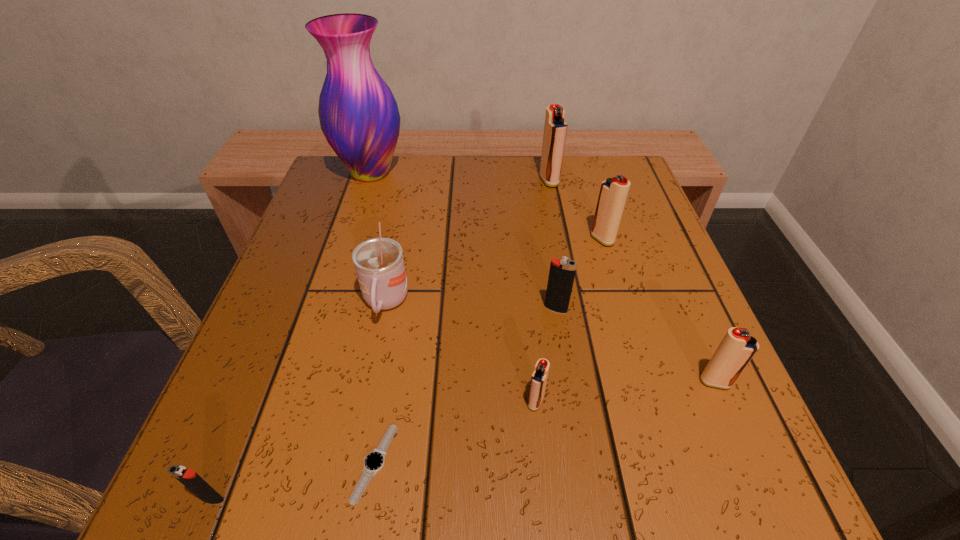
Locate an element on the screen. This screenshot has width=960, height=540. igniter located at the left edge is located at coordinates (189, 478).

Where is `object situated at the far left corner`? Image resolution: width=960 pixels, height=540 pixels. object situated at the far left corner is located at coordinates (359, 117).

Locate an element on the screen. object that is at the near left corner is located at coordinates (189, 478).

The height and width of the screenshot is (540, 960). In the image, there is a desktop. What are the coordinates of `vacant space at the far edge` in the screenshot? It's located at (445, 210).

The height and width of the screenshot is (540, 960). In order to click on vacant area at the near edge in this screenshot , I will do `click(480, 457)`.

Locate an element on the screen. The height and width of the screenshot is (540, 960). vacant space at the left edge of the desktop is located at coordinates (313, 313).

Find the location of a particular element. This screenshot has height=540, width=960. blank space at the right edge of the desktop is located at coordinates (668, 411).

What are the coordinates of `vacant space at the far left corner` in the screenshot? It's located at (393, 166).

This screenshot has width=960, height=540. I want to click on vacant space at the far right corner of the desktop, so click(x=581, y=167).

Where is `free space at the near right corner of the desktop`? The image size is (960, 540). free space at the near right corner of the desktop is located at coordinates (758, 443).